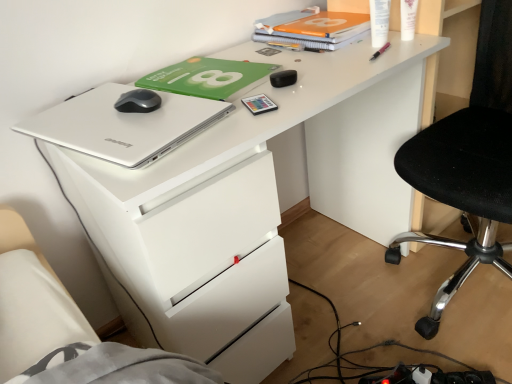
Locate an element on the screen. vacant area on the back side of matte plastic card at center, placed as the 5th stationery when sorted from right to left is located at coordinates (269, 80).